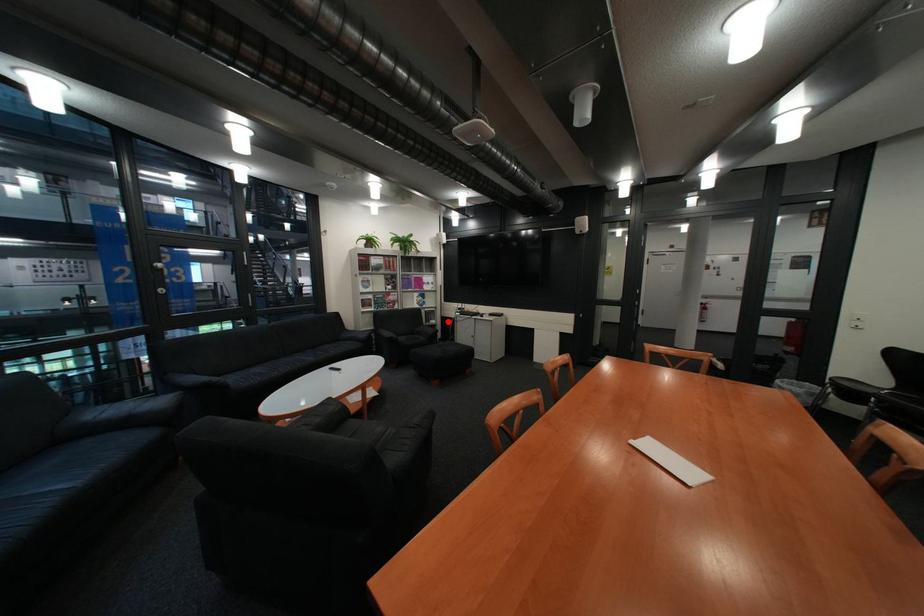
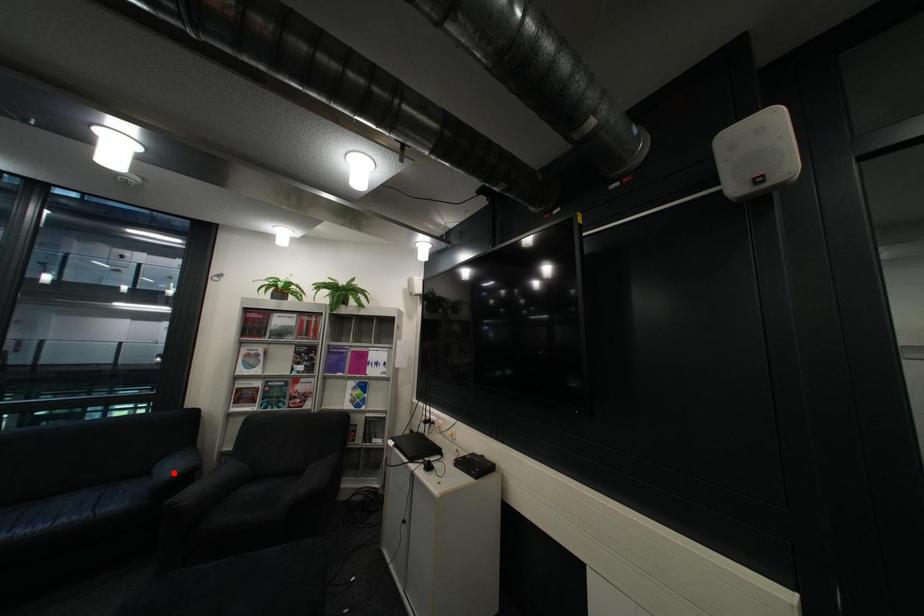
I am providing you with two images of the same scene from different viewpoints. A red point is marked on the first image and another point is marked on the second image. Do the highlighted points in image1 and image2 indicate the same real-world spot?

No